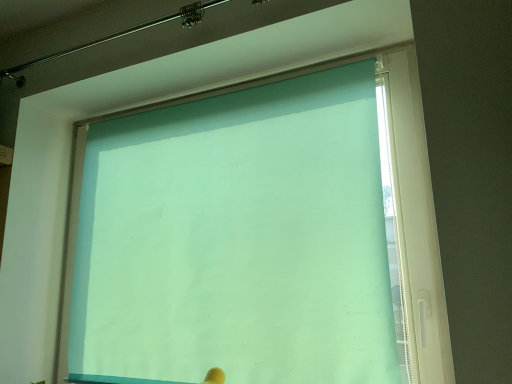
Locate an element on the screen. teal matte window at upper center is located at coordinates (258, 236).

What do you see at coordinates (258, 236) in the screenshot?
I see `teal matte window at upper center` at bounding box center [258, 236].

In order to face teal matte window at upper center, should I rotate leftwards or rightwards?

Rotate your view left by about 5.743°.

Identify the location of teal matte window at upper center. (258, 236).